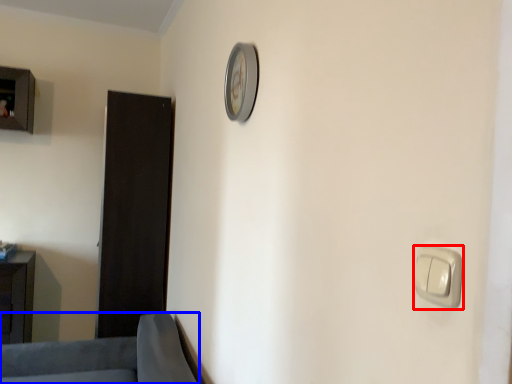
Question: Which of the following is the farthest to the observer, light switch (highlighted by a red box) or furniture (highlighted by a blue box)?

Choices:
 (A) light switch
 (B) furniture

Answer: (B)